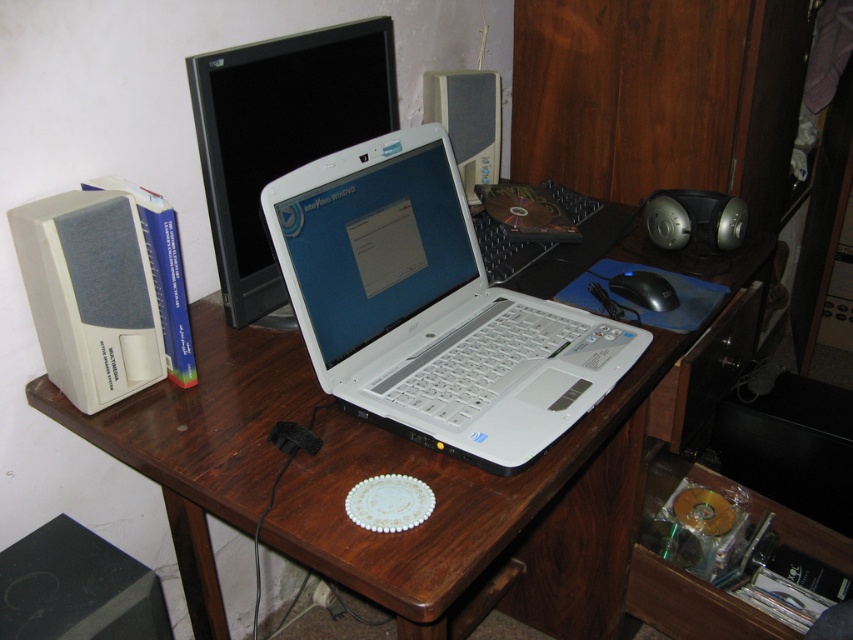
You are organizing your desk and want to stack the matte gray speaker at center on top of the black plastic mouse at lower right. Is this possible based on their sizes?

The matte gray speaker at center is taller than the black plastic mouse at lower right, so stacking them would not be possible since the speaker is taller and may not fit on top of the mouse.

You are organizing cables on the desk and need to connect a new USB cable that is 1 meter long. The cable can only reach 0.5 meters from its starting point. If you start at the white matte speaker at left, will it reach the black plastic mouse at lower right?

The white matte speaker at left is closer to the viewer than the black plastic mouse at lower right. Since the cable can only reach 0.5 meters and the distance between them is greater than that, the cable will not reach.

You are a delivery person standing at the entrance of the office. You need to place a package on the desk without moving any existing items. The package is 12 inches wide. Is there enough space between the black glossy monitor at upper center and the edge of the desk to fit the package?

The distance between the black glossy monitor at upper center and the edge of the desk is not provided in the description, so we cannot determine if there is enough space. Please check the desk dimensions or available space.